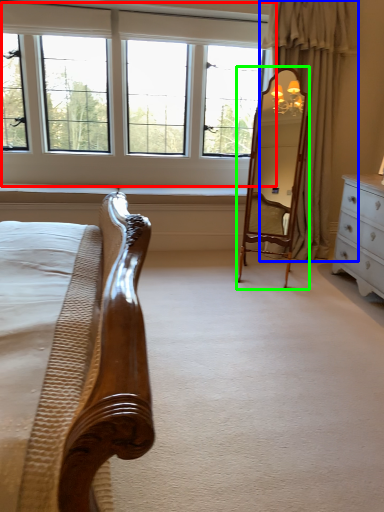
Question: Which object is positioned farthest from window (highlighted by a red box)? Select from curtain (highlighted by a blue box) and mirror (highlighted by a green box).

Choices:
 (A) curtain
 (B) mirror

Answer: (B)